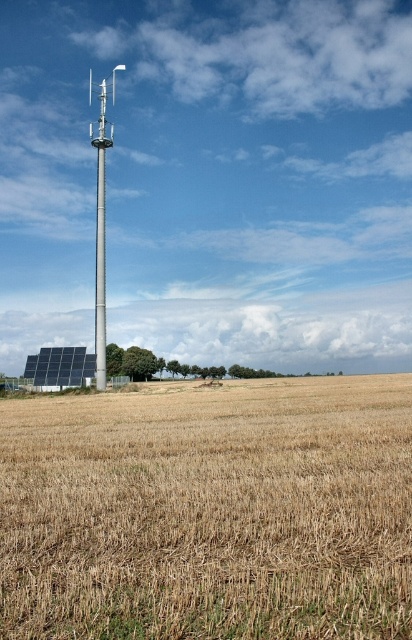
You are a farmer inspecting your field. You notice the brown dry grass at lower center and the black textured solar panel at lower left. Which object covers a bigger area in the image?

The brown dry grass at lower center has a larger size compared to the black textured solar panel at lower left, so it covers a bigger area in the image.

You are a maintenance worker needing to inspect both the black textured solar panel at lower left and the metallic pole at center. Given that your tool kit can only carry enough supplies for a 7 meter journey, will you have enough supplies to travel between both objects?

The black textured solar panel at lower left and the metallic pole at center are 8.08 meters apart from each other. Since the distance exceeds the 7 meter capacity of your tool kit, you will not have enough supplies to travel between both objects.

You are a farmer checking the field. You notice the brown dry grass at lower center and the metallic pole at center. Which object occupies more horizontal space in the image?

The brown dry grass at lower center might be wider than the metallic pole at center, so it likely occupies more horizontal space.